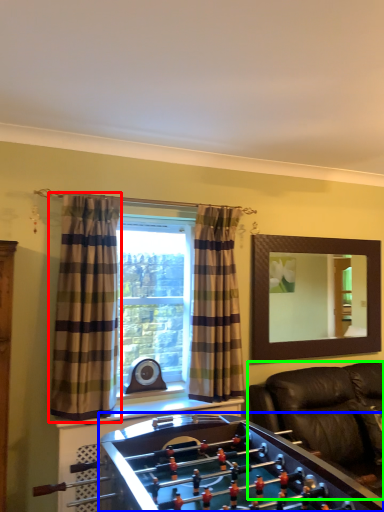
Question: Considering the real-world distances, which object is farthest from curtain (highlighted by a red box)? furniture (highlighted by a blue box) or studio couch (highlighted by a green box)?

Choices:
 (A) furniture
 (B) studio couch

Answer: (B)